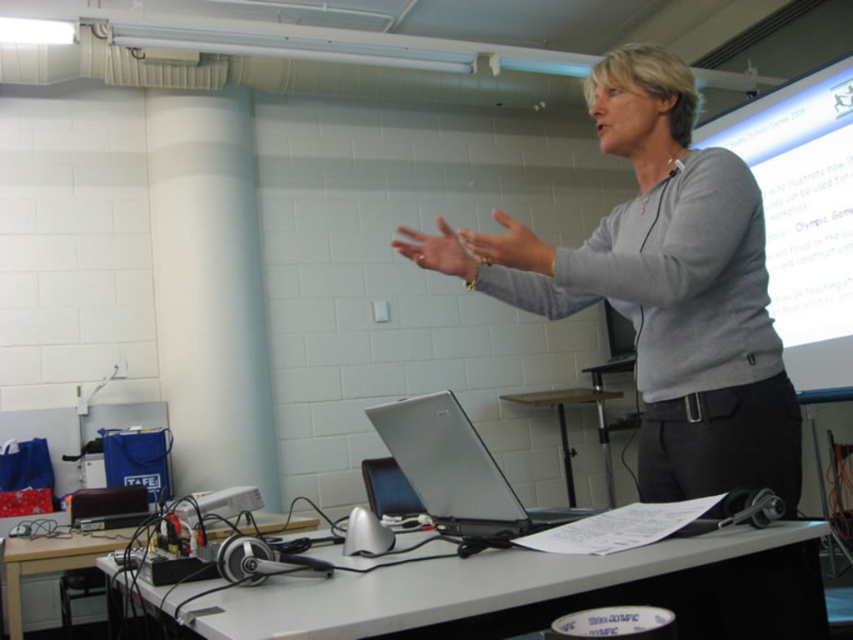
Does point (701, 534) come closer to viewer compared to point (409, 404)?

That is True.

Which of these two, white plastic table at center or silver metallic laptop at center, stands taller?

silver metallic laptop at center

You are a GUI agent. You are given a task and a screenshot of the screen. Output one action in this format:
    pyautogui.click(x=<x>, y=<y>)
    Task: Click on the white plastic table at center
    This screenshot has width=853, height=640.
    Given the screenshot: What is the action you would take?
    pyautogui.click(x=529, y=592)

The image size is (853, 640). Find the location of `white plastic table at center`. white plastic table at center is located at coordinates (529, 592).

Can you confirm if white glossy projection screen at upper right is positioned to the right of black plastic headphones at lower left?

Correct, you'll find white glossy projection screen at upper right to the right of black plastic headphones at lower left.

Could you measure the distance between white glossy projection screen at upper right and black plastic headphones at lower left?

They are 3.04 meters apart.

Who is more forward, (820, 385) or (6, 573)?

Point (6, 573) is in front.

At what (x,y) coordinates should I click in order to perform the action: click on white glossy projection screen at upper right. Please return your answer as a coordinate pair (x, y). The width and height of the screenshot is (853, 640). Looking at the image, I should click on (804, 214).

Measure the distance between point (67, 552) and camera.

Point (67, 552) and camera are 2.34 meters apart from each other.

Does black plastic headphones at lower left have a lesser width compared to wooden table at center?

Yes, black plastic headphones at lower left is thinner than wooden table at center.

Is point (73, 544) positioned before point (563, 444)?

Yes, it is in front of point (563, 444).

Identify the location of black plastic headphones at lower left. (50, 561).